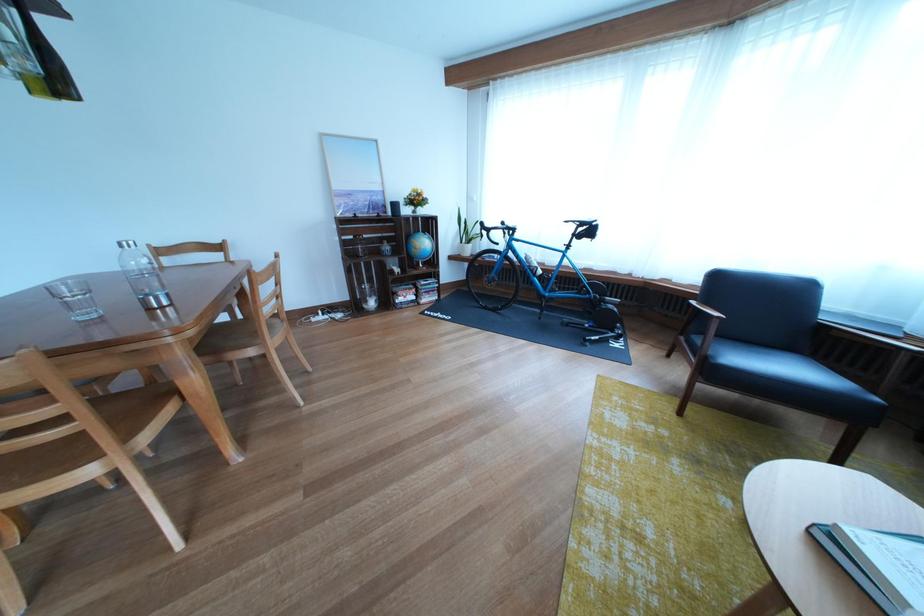
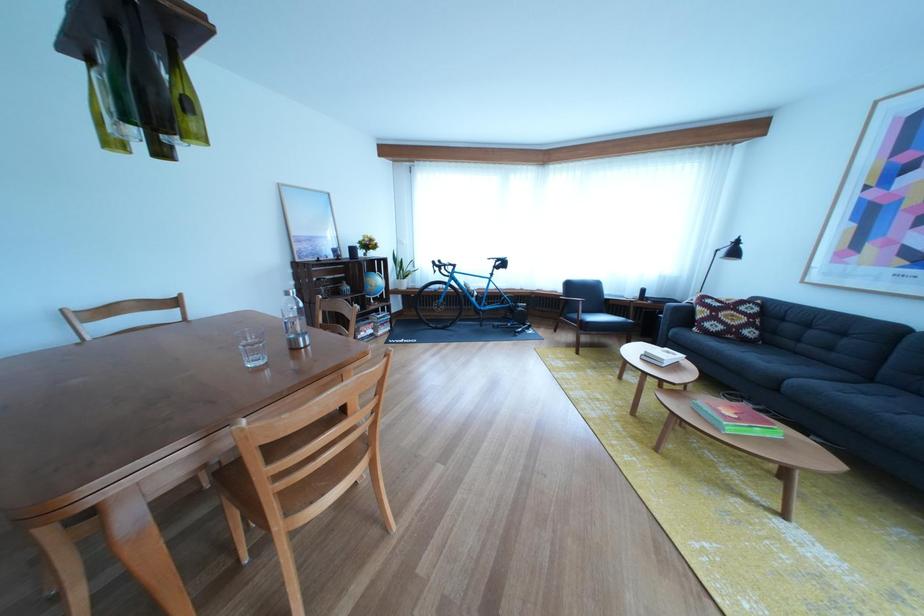
Find the pixel in the second image that matches point (448, 225) in the first image.

(398, 265)